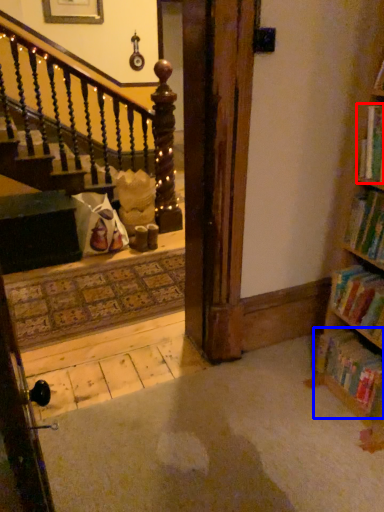
Question: Among these objects, which one is nearest to the camera, book (highlighted by a red box) or book (highlighted by a blue box)?

Choices:
 (A) book
 (B) book

Answer: (A)